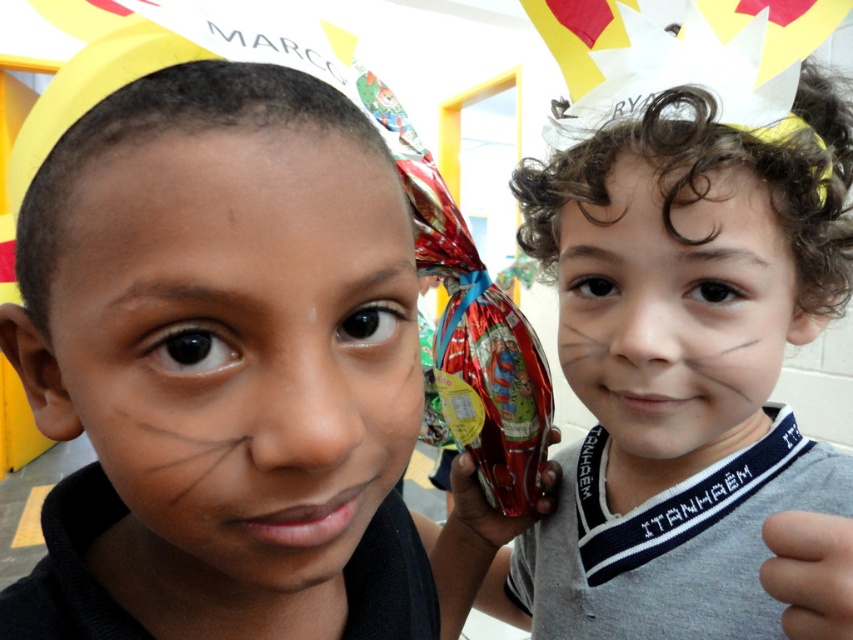
Between matte black face at left and skinny flesh at lower right, which one has less height?

With less height is skinny flesh at lower right.

Who is more forward, (326,337) or (833,614)?

Positioned in front is point (326,337).

Where is `matte black face at left`? The width and height of the screenshot is (853, 640). matte black face at left is located at coordinates [x=235, y=353].

Who is lower down, smooth skin face at right or metallic shiny chocolate bar at center?

Positioned lower is metallic shiny chocolate bar at center.

Based on the photo, does smooth skin face at right have a smaller size compared to metallic shiny chocolate bar at center?

No.

Is point (563, 228) more distant than point (544, 486)?

No.

The image size is (853, 640). I want to click on smooth skin face at right, so click(x=675, y=316).

Does matte black face at left appear under smooth skin face at right?

Indeed, matte black face at left is positioned under smooth skin face at right.

This screenshot has height=640, width=853. I want to click on matte black face at left, so click(235, 353).